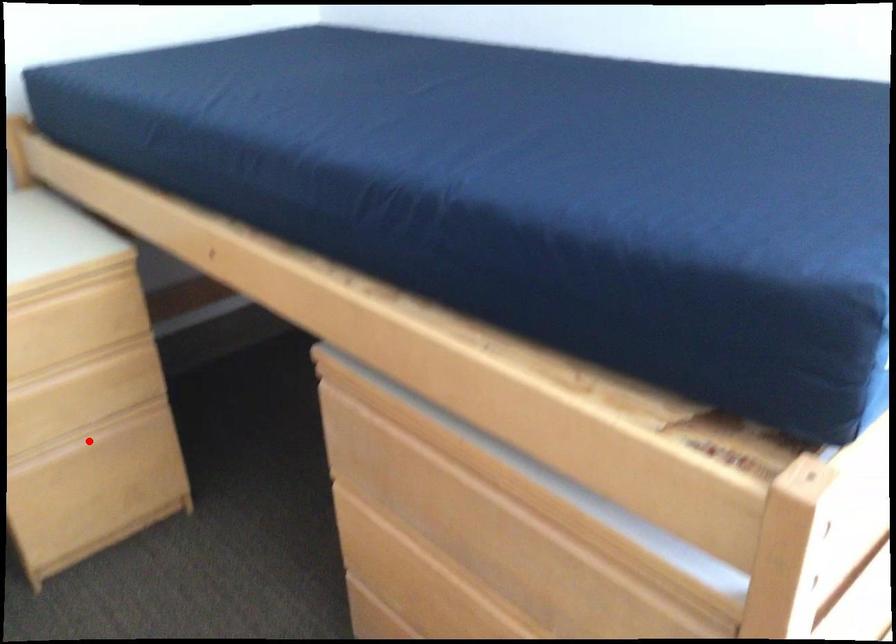
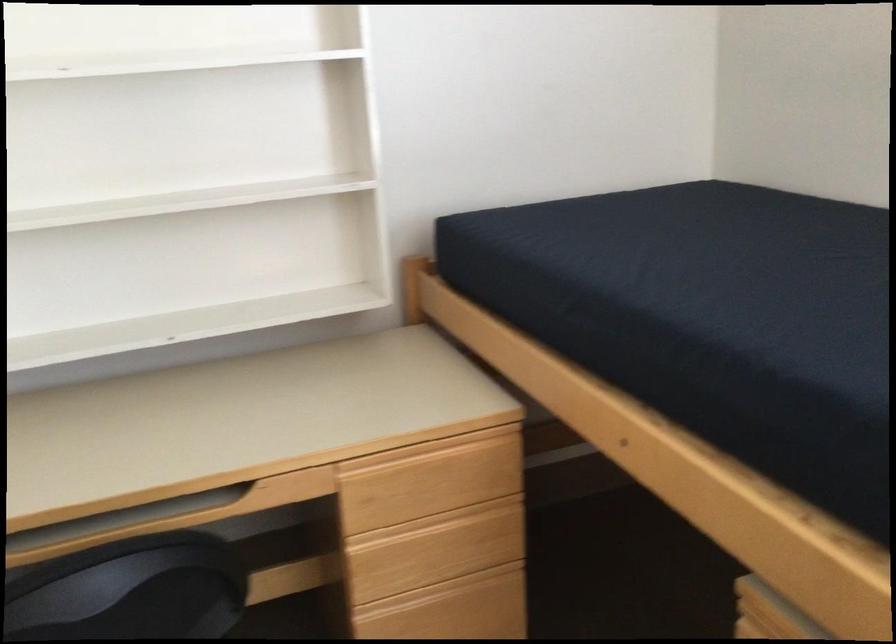
Where in the second image is the point corresponding to the highlighted location from the first image?

(442, 592)